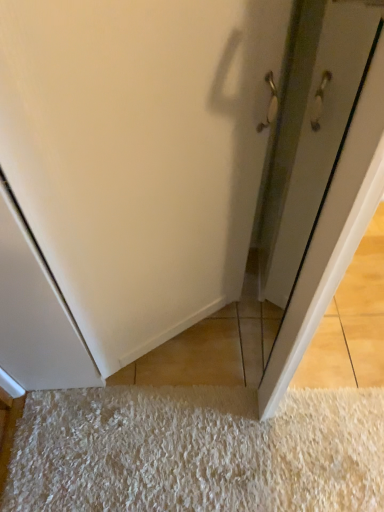
Where is `free point above white shaggy rug at lower center (from a real-world perspective)`? free point above white shaggy rug at lower center (from a real-world perspective) is located at coordinates (214, 442).